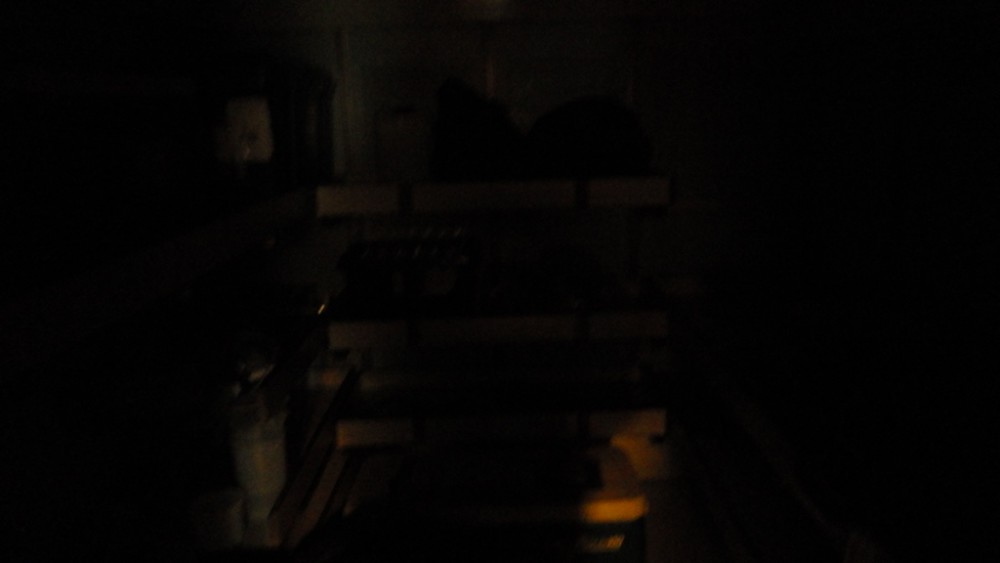
Find the location of a particular element. This screenshot has width=1000, height=563. floor is located at coordinates (330, 466).